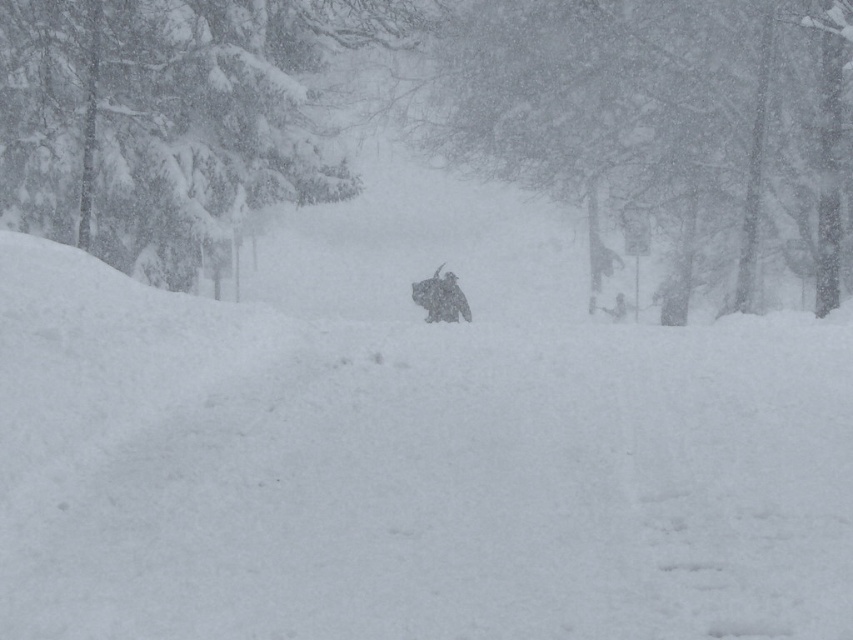
Question: Does snow-covered tree at center have a lesser width compared to snow-covered evergreen tree at upper left?

Choices:
 (A) yes
 (B) no

Answer: (B)

Question: Does snow-covered tree at center lie behind snow-covered evergreen tree at upper left?

Choices:
 (A) yes
 (B) no

Answer: (A)

Question: Among these objects, which one is farthest from the camera?

Choices:
 (A) white fluffy hill at center
 (B) snow-covered evergreen tree at upper left

Answer: (B)

Question: Observing the image, what is the correct spatial positioning of snow-covered tree at center in reference to snow-covered evergreen tree at upper left?

Choices:
 (A) above
 (B) below

Answer: (B)

Question: Estimate the real-world distances between objects in this image. Which object is closer to the snow-covered tree at center?

Choices:
 (A) snow-covered evergreen tree at upper left
 (B) white fluffy hill at center

Answer: (A)

Question: Which object is positioned closest to the snow-covered evergreen tree at upper left?

Choices:
 (A) white fluffy hill at center
 (B) snow-covered tree at center

Answer: (B)